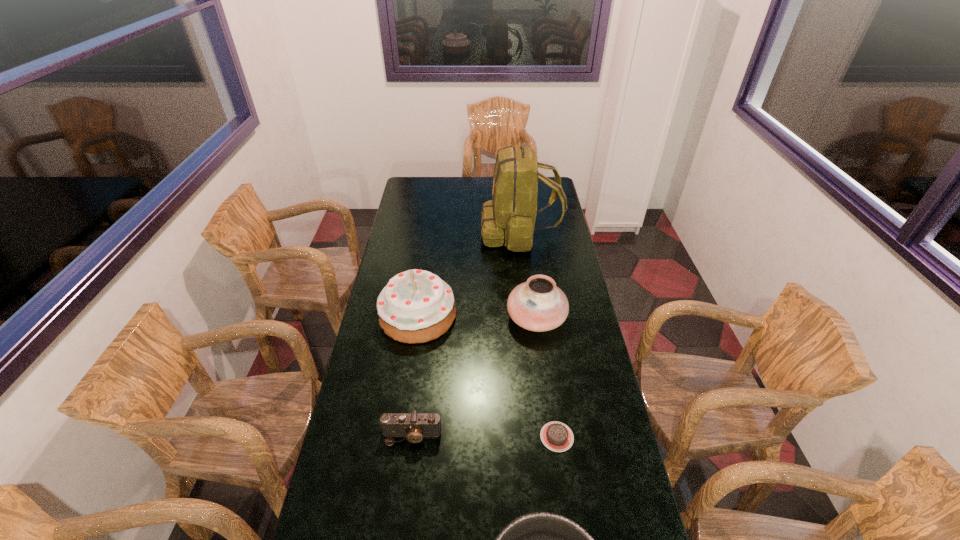
You are a GUI agent. You are given a task and a screenshot of the screen. Output one action in this format:
    pyautogui.click(x=<x>, y=<y>)
    Task: Click on the blank area in the image that satisfies the following two spatial constraints: 1. on the front-facing side of the shortest object; 2. on the right side of the camera
    
    Given the screenshot: What is the action you would take?
    pyautogui.click(x=412, y=437)

What are the coordinates of `free space in the image that satisfies the following two spatial constraints: 1. on the front-facing side of the tallest object; 2. on the right side of the shortest object` in the screenshot? It's located at (544, 437).

Locate an element on the screen. Image resolution: width=960 pixels, height=540 pixels. vacant space that satisfies the following two spatial constraints: 1. on the front-facing side of the tallest object; 2. on the left side of the pottery is located at coordinates (530, 318).

What are the coordinates of `free space that satisfies the following two spatial constraints: 1. on the front-facing side of the tallest object; 2. on the front-facing side of the camera` in the screenshot? It's located at (543, 436).